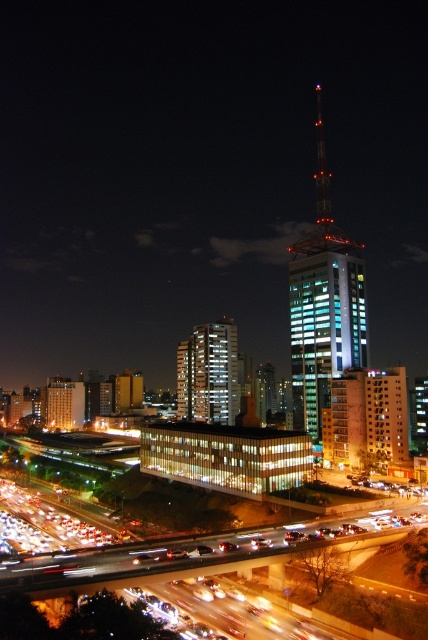
Looking at this image, you are driving a car and want to reach the central building. You see two points marked on your GPS. One is at point (x=341, y=244) and the other at point (x=204, y=538). Which point should you head towards first to get closer to the central building?

You should head towards point (x=204, y=538) first because point (x=341, y=244) is behind it, meaning point (x=204, y=538) is closer to the central building.

You are a city planner analyzing the cityscape. You need to determine which of the two central buildings, the blue glass tower at center or the white glass building at center, occupies more space in the image. Based on the provided information, which one is larger?

The blue glass tower at center has a larger size compared to the white glass building at center, so it occupies more space in the image.